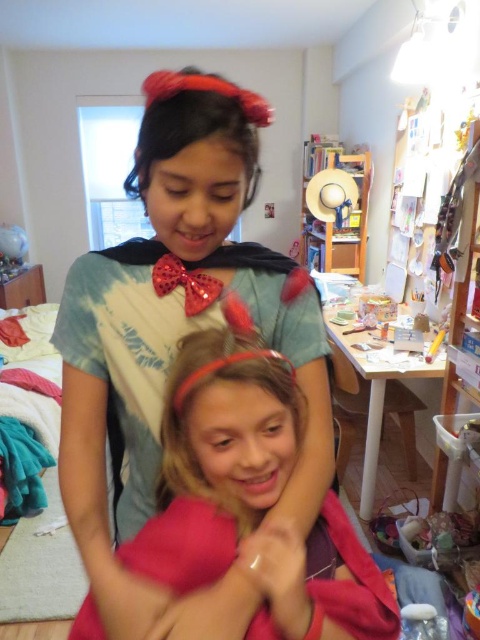
Question: Does pink fabric at center lie behind shiny sequined bow tie at center?

Choices:
 (A) yes
 (B) no

Answer: (B)

Question: Can you confirm if matte black cape at upper center is smaller than shiny sequined bow tie at center?

Choices:
 (A) no
 (B) yes

Answer: (A)

Question: Can you confirm if matte black cape at upper center is thinner than blonde hair at center?

Choices:
 (A) yes
 (B) no

Answer: (B)

Question: Which object is positioned farthest from the matte black cape at upper center?

Choices:
 (A) shiny sequined bow tie at center
 (B) matte red headband at upper center
 (C) pink fabric at center

Answer: (B)

Question: Based on their relative distances, which object is farther from the matte red headband at upper center?

Choices:
 (A) shiny sequined bow tie at center
 (B) matte black cape at upper center

Answer: (B)

Question: Which object appears farthest from the camera in this image?

Choices:
 (A) pink fabric at center
 (B) matte red headband at upper center
 (C) blonde hair at center

Answer: (B)